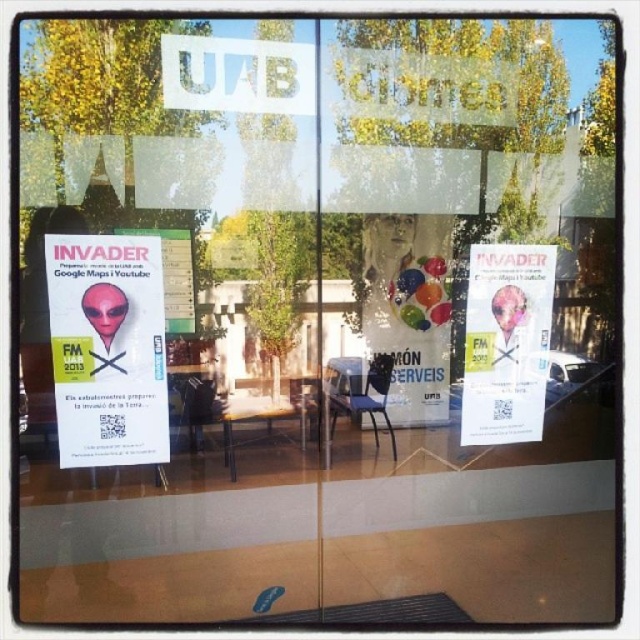
You are a visitor standing in front of the glass window display. You notice the matte alien head at left and the white paper poster at center. Which object takes up more space on the window?

The white paper poster at center occupies more space than the matte alien head at left.

You are standing in front of the window display at UAB. You want to take a photo of the matte alien head at left without any reflections. Since the window is reflective, you need to position yourself at least 6 feet away to avoid glare. Can you take the photo from your current position?

The matte alien head at left is 6.04 feet away from the camera. Since you need to be at least 6 feet away to avoid glare, you can take the photo from your current position as you are just slightly beyond the required distance.

You are a visitor holding a smartphone that is 6 inches wide. You want to take a photo of both the matte alien head at left and the white paper poster at center displayed on the window. Can your smartphone capture both objects in one frame without moving?

The distance between the matte alien head at left and the white paper poster at center is 4.08 feet, which is approximately 49 inches. Since your smartphone is 6 inches wide, it can easily fit both objects within its camera frame as the distance between them is much larger than the phone width.